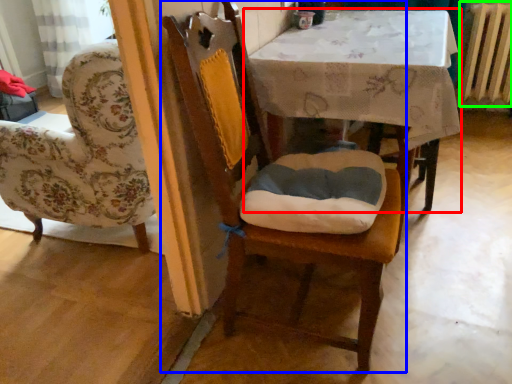
Question: Which is farther away from table (highlighted by a red box)? chair (highlighted by a blue box) or radiator (highlighted by a green box)?

Choices:
 (A) chair
 (B) radiator

Answer: (B)